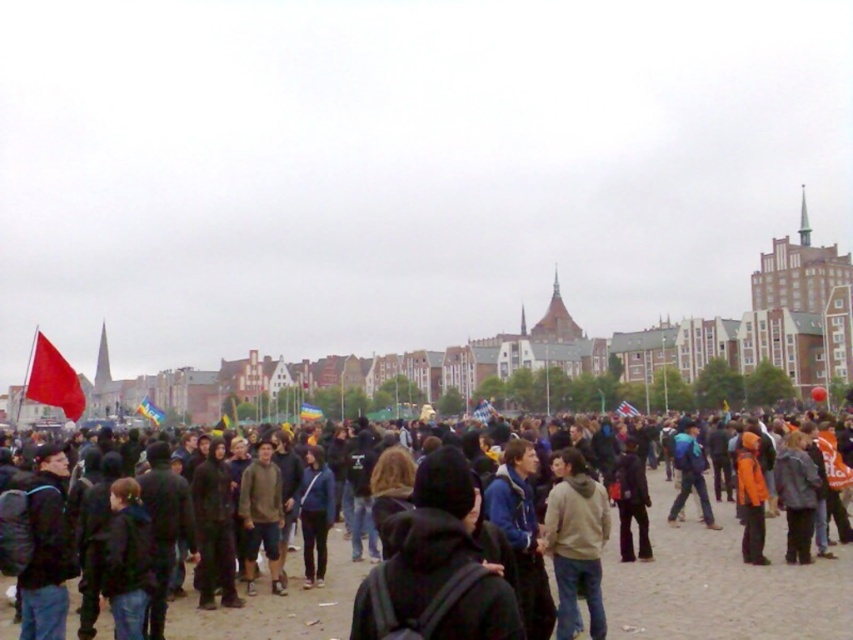
Does point (404, 612) lie behind point (33, 396)?

No, it is not.

What do you see at coordinates (434, 566) in the screenshot?
I see `dark gray hoodie at center` at bounding box center [434, 566].

Locate an element on the screen. dark gray hoodie at center is located at coordinates (434, 566).

Does blue fabric flag at center have a lesser height compared to rainbow fabric flag at center?

In fact, blue fabric flag at center may be taller than rainbow fabric flag at center.

Is blue fabric flag at center behind rainbow fabric flag at center?

Yes, it is.

Looking at this image, measure the distance between point (160, 417) and camera.

Point (160, 417) and camera are 157.01 meters apart from each other.

Identify the location of blue fabric flag at center. Image resolution: width=853 pixels, height=640 pixels. (149, 412).

From the picture: Is matte red flag at left in front of rainbow fabric flag at center?

Yes.

The height and width of the screenshot is (640, 853). Describe the element at coordinates (53, 380) in the screenshot. I see `matte red flag at left` at that location.

Is point (65, 369) closer to viewer compared to point (312, 419)?

That is True.

At what (x,y) coordinates should I click in order to perform the action: click on matte red flag at left. Please return your answer as a coordinate pair (x, y). The image size is (853, 640). Looking at the image, I should click on (53, 380).